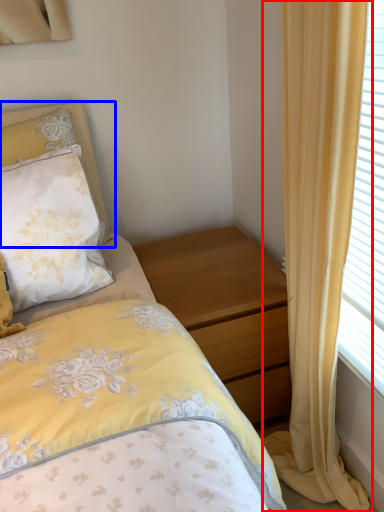
Question: Which object appears farthest to the camera in this image, curtain (highlighted by a red box) or pillow (highlighted by a blue box)?

Choices:
 (A) curtain
 (B) pillow

Answer: (B)